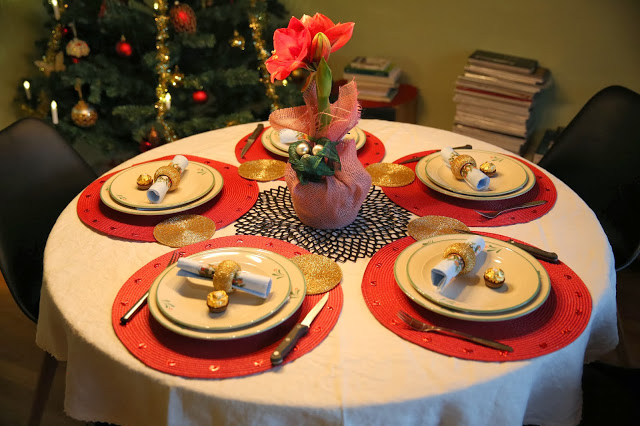
Identify the location of plates. (192, 185), (195, 297), (479, 285), (502, 175), (287, 137), (276, 150), (219, 176), (297, 286), (529, 184), (467, 316).